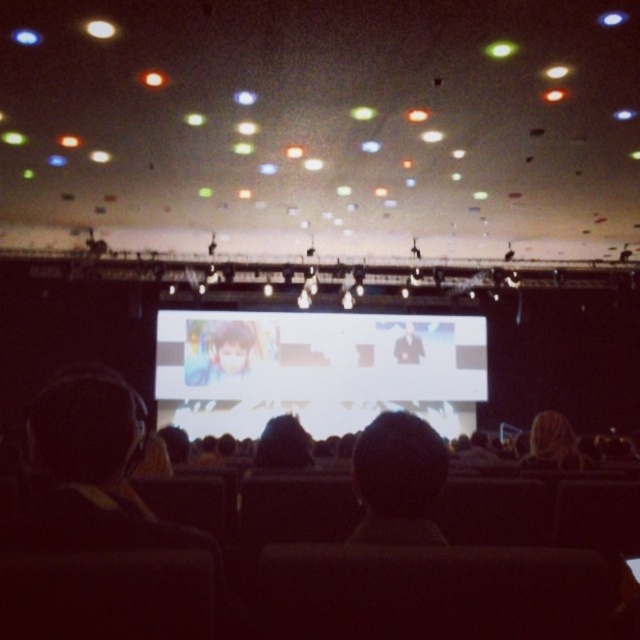
Measure the distance between dark hair at center and camera.

A distance of 3.86 feet exists between dark hair at center and camera.

Does point (360, 524) lie behind point (308, 460)?

That is False.

Is point (390, 474) more distant than point (259, 465)?

No, it is not.

This screenshot has height=640, width=640. Find the location of `dark hair at center`. dark hair at center is located at coordinates (397, 481).

Which is more to the left, white glossy projection screen at center or smooth skin portrait at center?

From the viewer's perspective, smooth skin portrait at center appears more on the left side.

Does white glossy projection screen at center have a larger size compared to smooth skin portrait at center?

No, white glossy projection screen at center is not bigger than smooth skin portrait at center.

The image size is (640, 640). Identify the location of white glossy projection screen at center. (316, 369).

Which is above, smooth skin portrait at center or smooth black hair at center?

smooth skin portrait at center is higher up.

Who is positioned more to the left, smooth skin portrait at center or smooth black hair at center?

smooth skin portrait at center

Image resolution: width=640 pixels, height=640 pixels. What do you see at coordinates (218, 349) in the screenshot?
I see `smooth skin portrait at center` at bounding box center [218, 349].

The width and height of the screenshot is (640, 640). I want to click on smooth skin portrait at center, so click(218, 349).